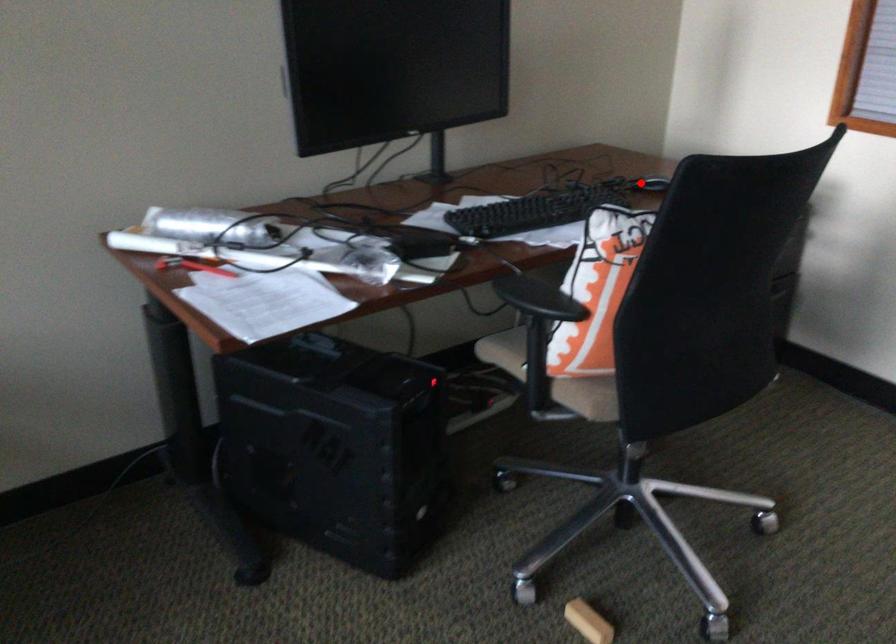
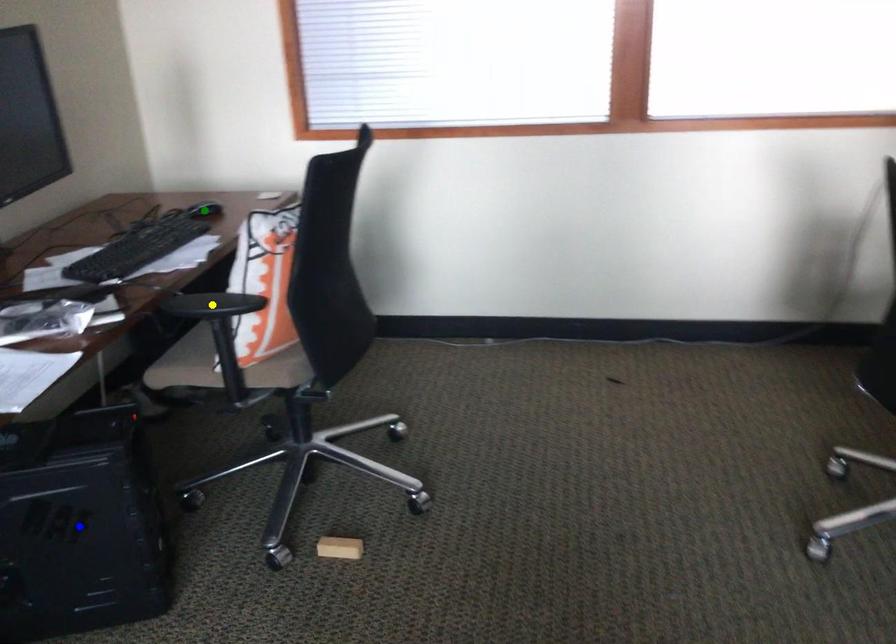
Question: I am providing you with two images of the same scene from different viewpoints. A red point is marked on the first image. You are given multiple points on the second image. Can you choose the point in image 2 that corresponds to the point in image 1?

Choices:
 (A) blue point
 (B) yellow point
 (C) green point

Answer: (C)